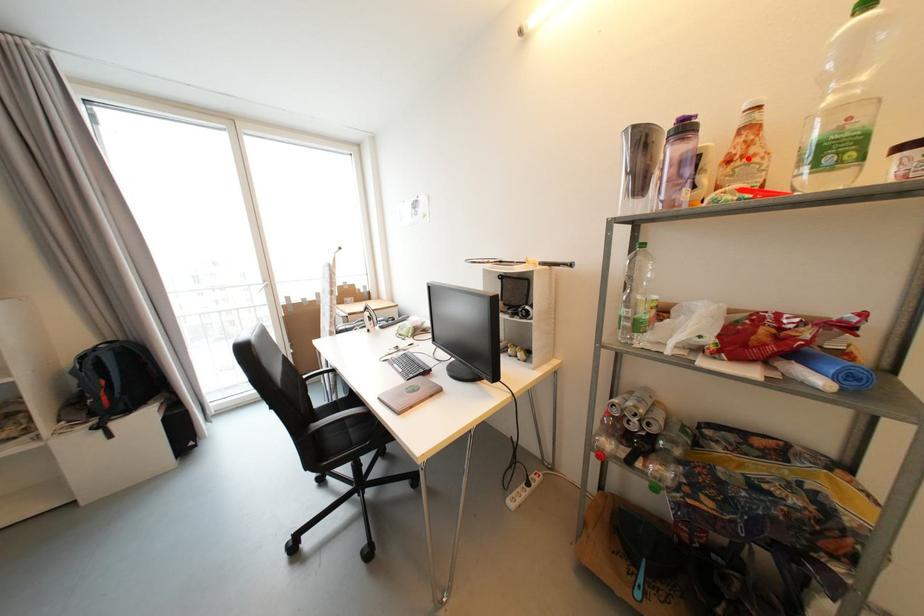
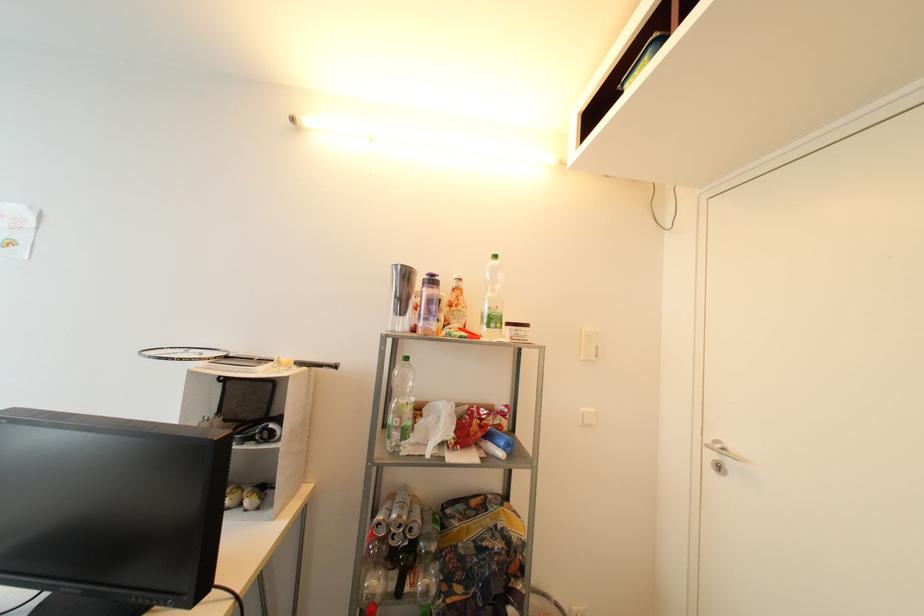
The point at the highlighted location is marked in the first image. Where is the corresponding point in the second image?

(462, 307)